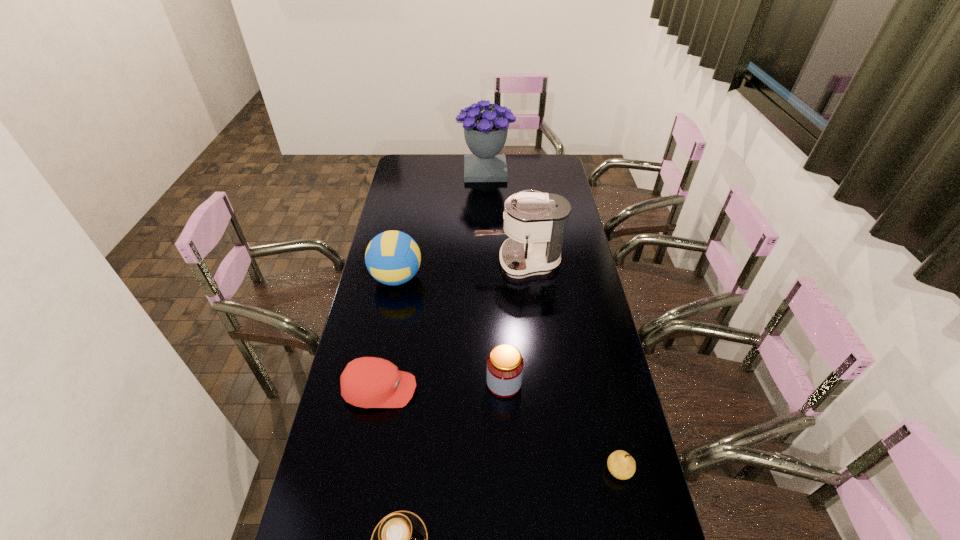
This screenshot has width=960, height=540. Identify the location of free space between the second tallest object and the third tallest object. (458, 271).

This screenshot has height=540, width=960. Identify the location of unoccupied area between the cap and the jar. (443, 386).

You are a GUI agent. You are given a task and a screenshot of the screen. Output one action in this format:
    pyautogui.click(x=<x>, y=<y>)
    Task: Click on the vacant point located between the third tallest object and the fourth tallest object
    This screenshot has width=960, height=540.
    Given the screenshot: What is the action you would take?
    pyautogui.click(x=450, y=330)

This screenshot has width=960, height=540. I want to click on the closest object to the second nearest object, so click(505, 364).

Where is `the second closest object relative to the farthest object`? the second closest object relative to the farthest object is located at coordinates (392, 257).

The image size is (960, 540). What are the coordinates of `free space that satisfies the following two spatial constraints: 1. on the front side of the jar; 2. on the right side of the pear` in the screenshot? It's located at (508, 470).

I want to click on vacant region that satisfies the following two spatial constraints: 1. on the front-facing side of the coffee maker; 2. on the right side of the second nearest object, so click(538, 470).